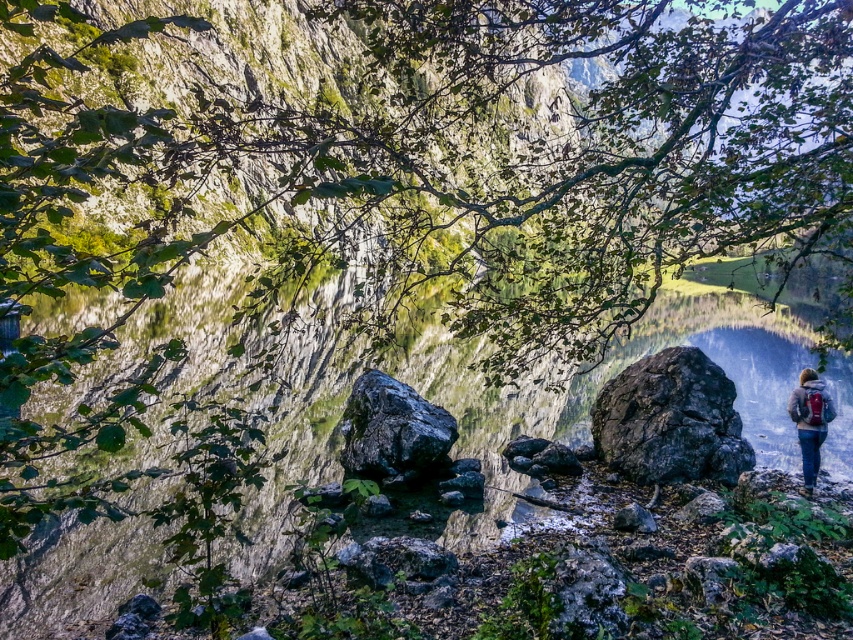
You are a hiker who wants to cross the rocky terrain. You see two rocks in the center of the path, a dark gray rock at center and a black rough rock at center. Which rock should you step on first if you are approaching from the left side of the path?

You should step on the black rough rock at center first because the dark gray rock at center is to the right of it, so when approaching from the left, the black rough rock at center comes first in your path.

You are hiking and come across a rocky area with a dark gray rock at center and a black rough rock at center. Which rock would you need to step over to reach the other?

The black rough rock at center is behind the dark gray rock at center, so to reach it, you would need to step over the dark gray rock at center.

From the picture: You are standing at the center of the rocky terrain and want to place a small flag exactly at the location of the dark gray rock at center. According to the coordinates provided, where should you place the flag?

The dark gray rock at center is located at point (670, 420), so you should place the flag at those coordinates to mark its exact position.